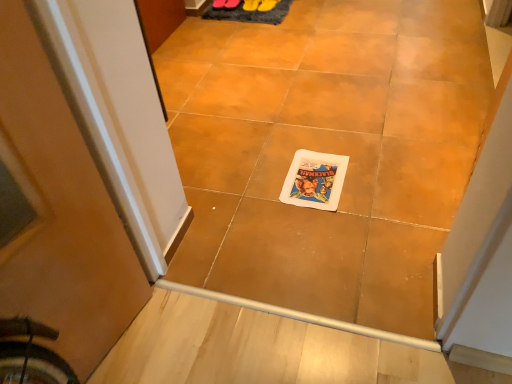
Locate an element on the screen. This screenshot has width=512, height=384. free space above matte paper comic book at center (from a real-world perspective) is located at coordinates (317, 174).